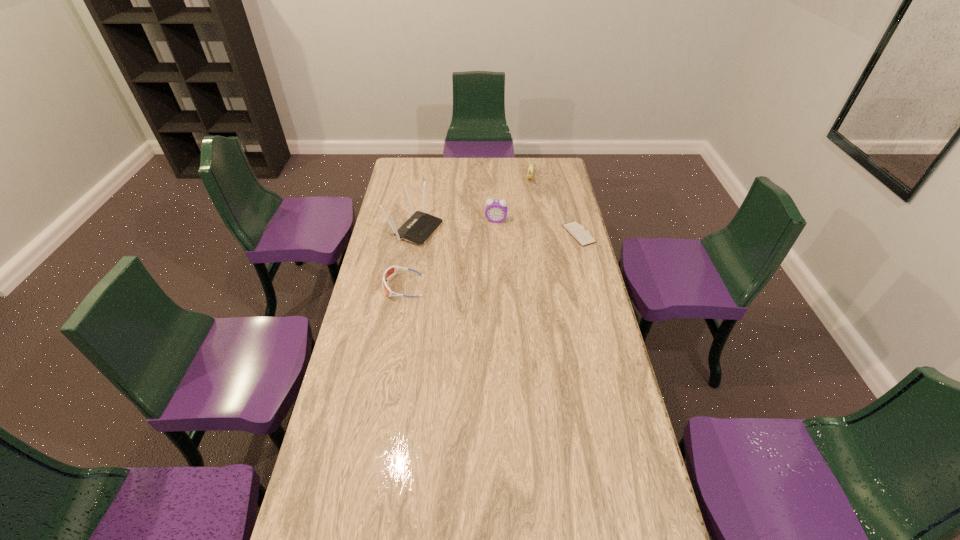
Find the location of a particular element. The image size is (960, 540). object located at the far edge is located at coordinates (530, 170).

Identify the location of goggles that is at the left edge. (390, 271).

Locate an element on the screen. The image size is (960, 540). router that is at the left edge is located at coordinates (417, 229).

The image size is (960, 540). I want to click on object situated at the right edge, so click(x=577, y=231).

Locate an element on the screen. free region at the far edge is located at coordinates (511, 163).

Where is `vacant space at the near edge of the desktop`? This screenshot has width=960, height=540. vacant space at the near edge of the desktop is located at coordinates (488, 516).

You are a GUI agent. You are given a task and a screenshot of the screen. Output one action in this format:
    pyautogui.click(x=<x>, y=<y>)
    Task: Click on the vacant space at the left edge of the desktop
    
    Given the screenshot: What is the action you would take?
    pyautogui.click(x=370, y=342)

You are a GUI agent. You are given a task and a screenshot of the screen. Output one action in this format:
    pyautogui.click(x=<x>, y=<y>)
    Task: Click on the vacant point at the right edge
    
    Given the screenshot: What is the action you would take?
    pyautogui.click(x=588, y=380)

Image resolution: width=960 pixels, height=540 pixels. I want to click on vacant space at the far left corner of the desktop, so click(x=400, y=159).

Locate an element on the screen. The image size is (960, 540). vacant area at the far right corner of the desktop is located at coordinates (545, 167).